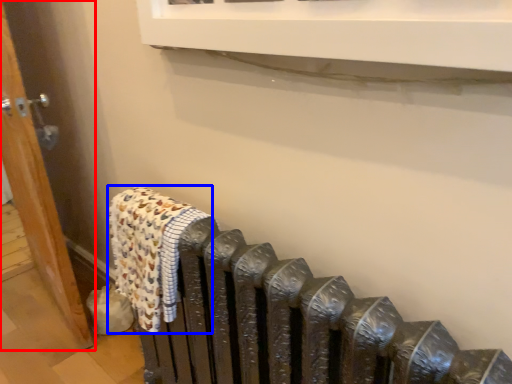
Question: Which object appears closest to the camera in this image, door (highlighted by a red box) or bath towel (highlighted by a blue box)?

Choices:
 (A) door
 (B) bath towel

Answer: (B)